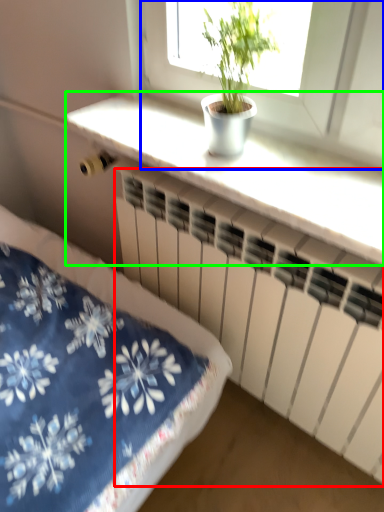
Question: Which object is the farthest from radiator (highlighted by a red box)? Choose among these: window (highlighted by a blue box) or counter top (highlighted by a green box).

Choices:
 (A) window
 (B) counter top

Answer: (A)